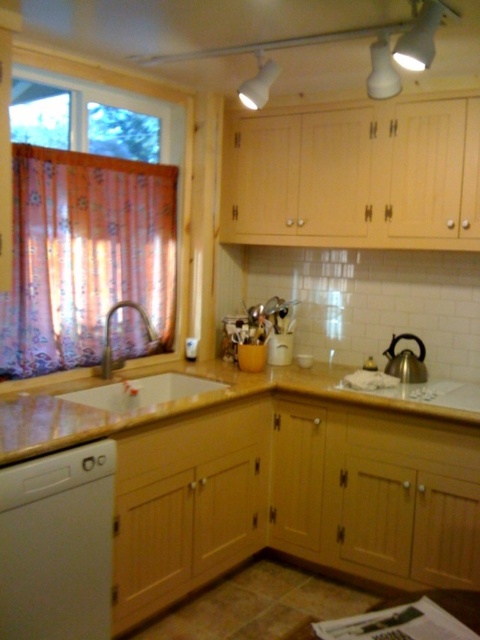
In the scene shown: You need to place a large cutting board on the light brown laminate counter top at center and the polished stainless steel kettle at right. Which surface can accommodate the cutting board better?

The light brown laminate counter top at center has a larger size compared to the polished stainless steel kettle at right, so it can accommodate the cutting board better.

You are standing in the kitchen and want to reach both the point at coordinates point (275, 532) and the point at coordinates point (388, 372). Which point will you reach first?

You will reach the point at coordinates point (275, 532) first because it is closer to you than the point at coordinates point (388, 372), which is further away.

From the picture: You are a chef preparing to place a new kitchen appliance on the counter. You have a polished stainless steel kettle at right and a light brown laminate counter top at center. Can you fit the kettle on the counter without moving any existing items?

The light brown laminate counter top at center has a greater width than the polished stainless steel kettle at right, so yes, the kettle can fit on the counter without moving existing items.